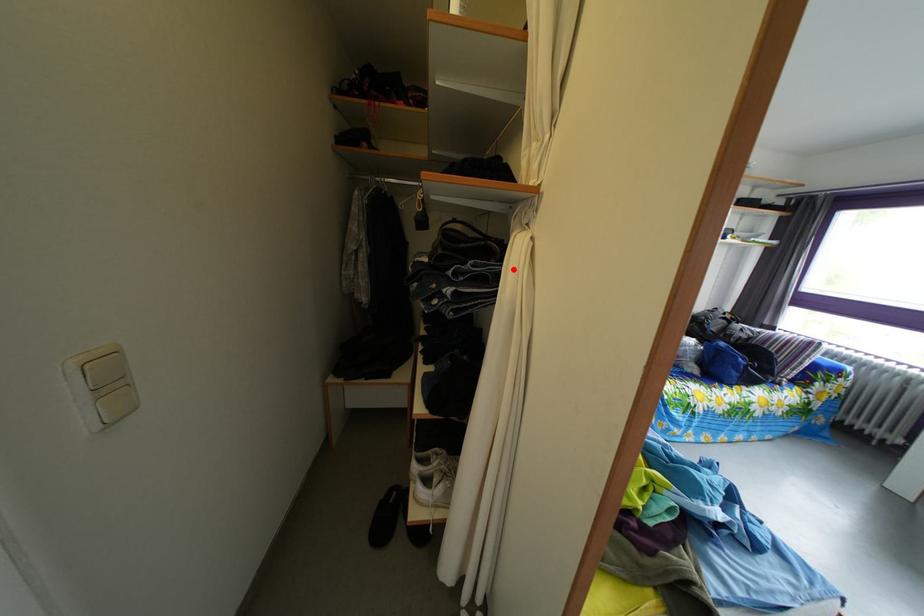
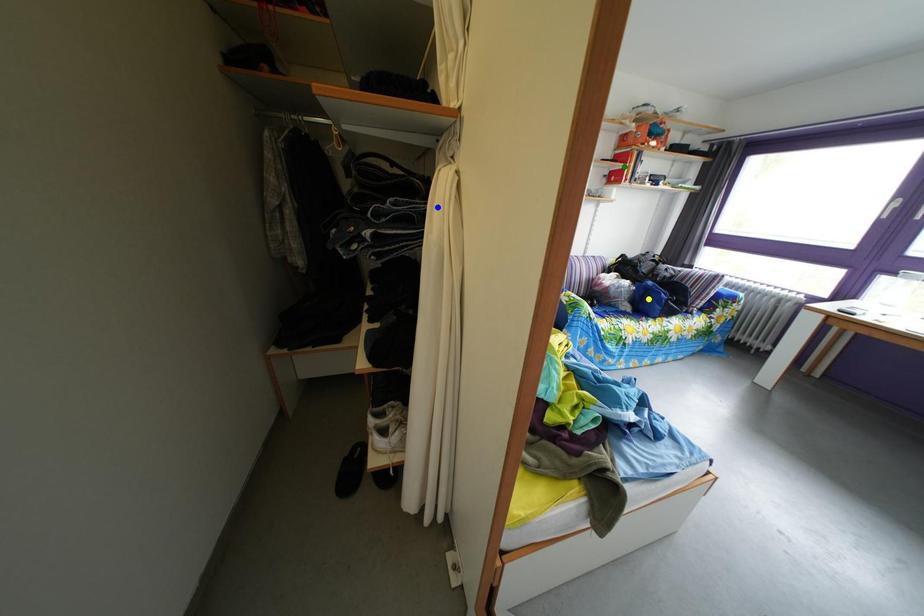
Question: I am providing you with two images of the same scene from different viewpoints. A red point is marked on the first image. You are given multiple points on the second image. Can you choose the point in image 2 that corresponds to the point in image 1?

Choices:
 (A) green point
 (B) yellow point
 (C) blue point

Answer: (C)